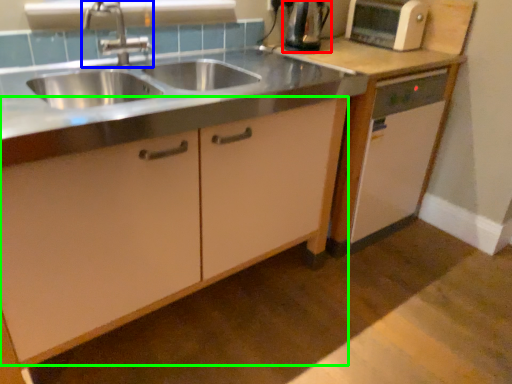
Question: Which object is the farthest from kitchen appliance (highlighted by a red box)? Choose among these: tap (highlighted by a blue box) or cabinetry (highlighted by a green box).

Choices:
 (A) tap
 (B) cabinetry

Answer: (B)